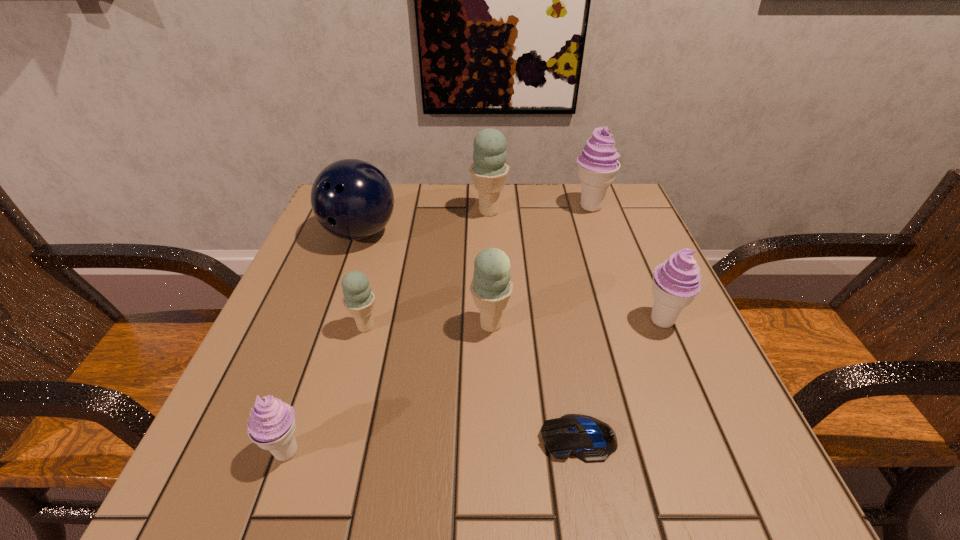
I want to click on the third object from right to left, so click(x=591, y=440).

Find the location of a particular element. The image size is (960, 540). vacant space located on the left of the biggest blue ice cream is located at coordinates (385, 212).

Where is `vacant space located 0.390m on the left of the farthest purple icecream`? The image size is (960, 540). vacant space located 0.390m on the left of the farthest purple icecream is located at coordinates (415, 207).

Locate an element on the screen. This screenshot has height=540, width=960. vacant space located 0.380m on the surface of the bowling ball near the finger holes is located at coordinates (298, 411).

Image resolution: width=960 pixels, height=540 pixels. I want to click on free space located 0.130m on the left of the second biggest blue ice cream, so click(x=399, y=325).

Where is `free region located 0.140m on the front of the second farthest purple icecream`? free region located 0.140m on the front of the second farthest purple icecream is located at coordinates (699, 407).

Find the location of `vacant space located on the back of the smallest blue ice cream`. vacant space located on the back of the smallest blue ice cream is located at coordinates (389, 240).

Identify the location of vacant space located 0.300m on the right of the leftmost purple icecream. This screenshot has width=960, height=540. (519, 451).

Where is `vacant space situated 0.240m on the button side of the computer mouse`? vacant space situated 0.240m on the button side of the computer mouse is located at coordinates (374, 438).

Image resolution: width=960 pixels, height=540 pixels. What are the coordinates of `vacant space located 0.380m on the button side of the computer mouse` in the screenshot? It's located at (278, 438).